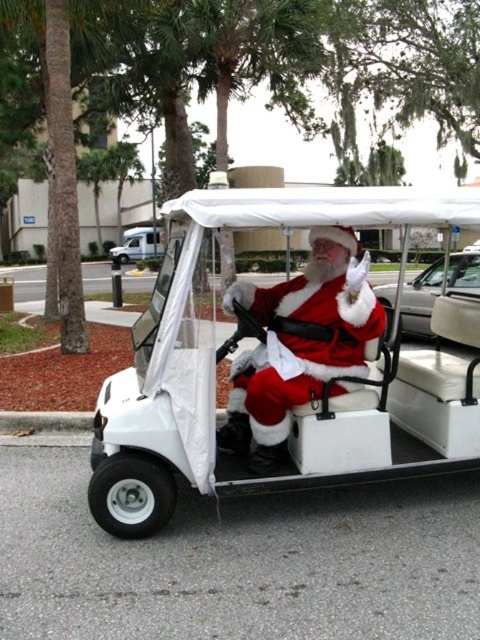
Question: Among these points, which one is farthest from the camera?

Choices:
 (A) (129, 240)
 (B) (109, 525)

Answer: (A)

Question: Which object appears farthest from the camera in this image?

Choices:
 (A) fuzzy red santa at center
 (B) white leather car at right

Answer: (B)

Question: Does white matte golf cart at center have a larger size compared to fuzzy red santa at center?

Choices:
 (A) no
 (B) yes

Answer: (A)

Question: Which object appears closest to the camera in this image?

Choices:
 (A) white glossy van at upper left
 (B) white matte golf cart at center
 (C) fuzzy red santa at center

Answer: (C)

Question: Does fuzzy red santa at center come in front of white glossy van at upper left?

Choices:
 (A) yes
 (B) no

Answer: (A)

Question: Observing the image, what is the correct spatial positioning of white leather car at right in reference to white glossy van at upper left?

Choices:
 (A) right
 (B) left

Answer: (A)